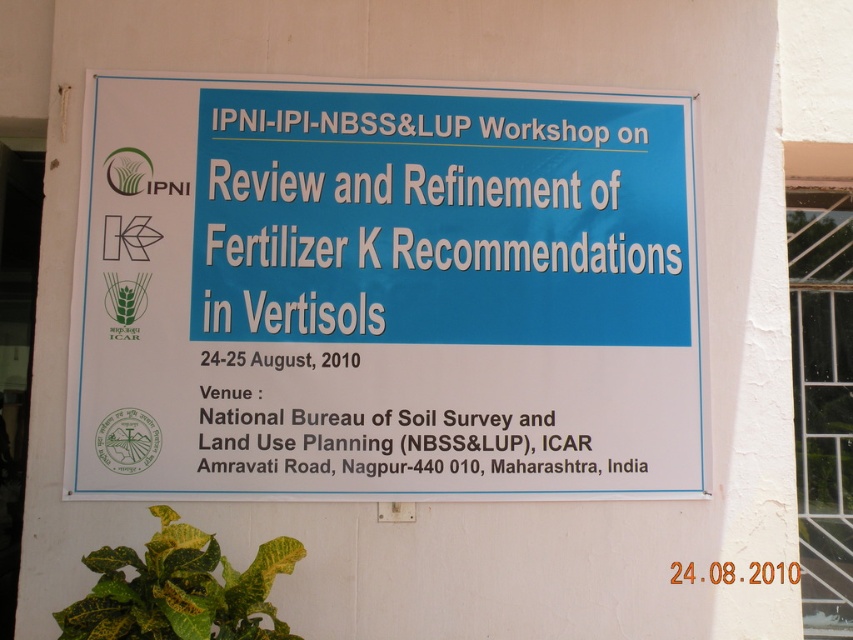
Question: Can you confirm if white paper sign at center is bigger than yellow-green leafy plant at lower left?

Choices:
 (A) no
 (B) yes

Answer: (B)

Question: Among these points, which one is nearest to the camera?

Choices:
 (A) (271, 84)
 (B) (244, 589)

Answer: (B)

Question: Is white paper sign at center to the left of yellow-green leafy plant at lower left from the viewer's perspective?

Choices:
 (A) no
 (B) yes

Answer: (A)

Question: Among these objects, which one is nearest to the camera?

Choices:
 (A) yellow-green leafy plant at lower left
 (B) white paper sign at center

Answer: (A)

Question: Is white paper sign at center smaller than yellow-green leafy plant at lower left?

Choices:
 (A) no
 (B) yes

Answer: (A)

Question: Which of the following is the closest to the observer?

Choices:
 (A) (389, 173)
 (B) (167, 620)

Answer: (B)